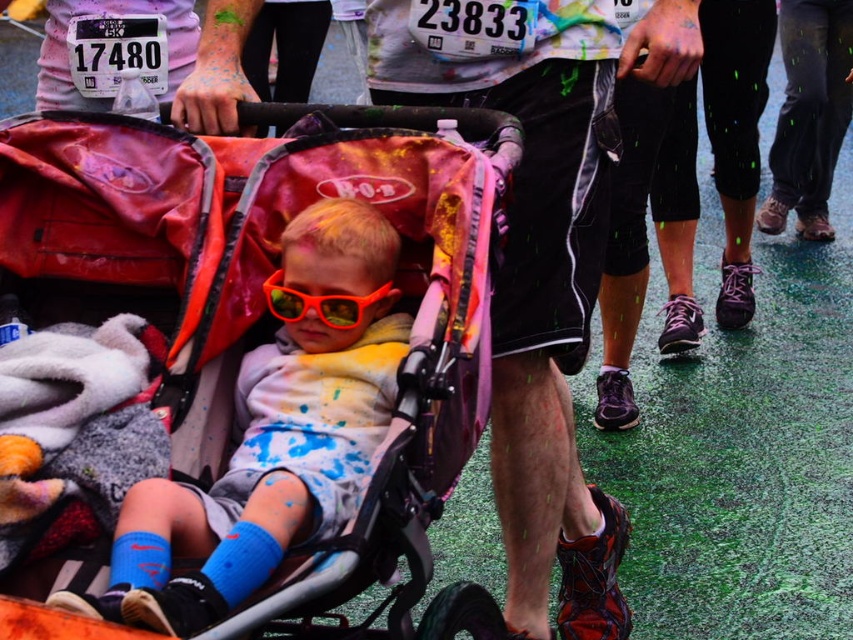
You are a photographer at the event and need to position yourself so that both the matte black shorts at center and the shiny orange plastic goggles at center are visible in your shot. Which object should you place closer to the left side of your frame to ensure both are captured?

The shiny orange plastic goggles at center should be placed closer to the left side of your frame since the matte black shorts at center are to the right of them.

You are a photographer at the event and need to capture a photo of both the matte pink stroller at center and the matte black shorts at center in the same frame. The camera you are using has a maximum focus range of 35 inches. Will you be able to include both objects in the photo without moving the camera?

The matte pink stroller at center and matte black shorts at center are 34.68 inches apart from each other, which is within the camera maximum focus range of 35 inches. Therefore, you can capture both objects in the same frame without moving the camera.

You are a photographer at the event and want to capture a photo of the matte pink stroller at center without any obstructions. Since the shiny orange plastic goggles at center might block the view, can you adjust your position to frame the stroller properly?

The matte pink stroller at center is positioned under the shiny orange plastic goggles at center, so moving your camera position slightly downward would allow you to capture the stroller without the goggles obstructing the view.